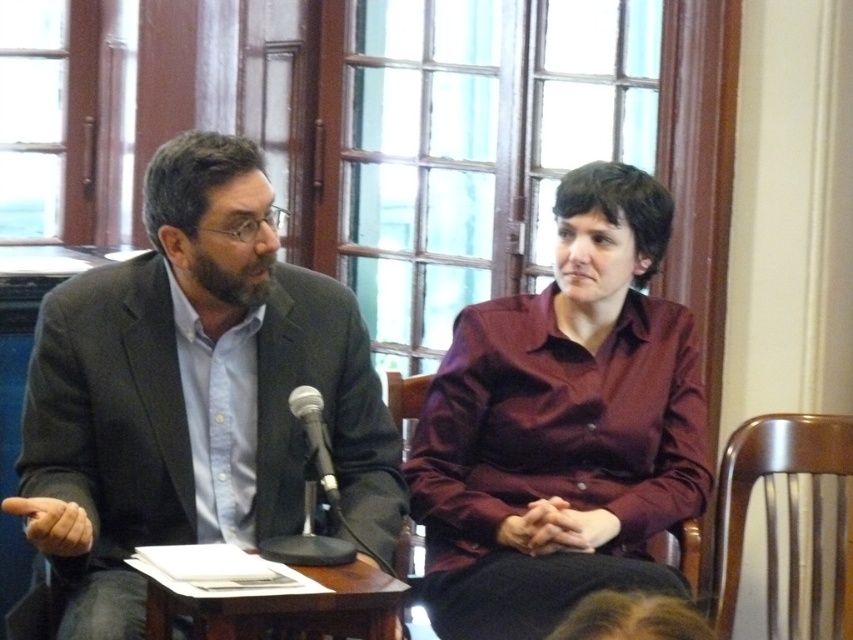
Who is shorter, brown wooden table at center or wooden chair at center?

With less height is brown wooden table at center.

Does point (289, 627) come farther from viewer compared to point (390, 408)?

No, it is in front of (390, 408).

Locate an element on the screen. The width and height of the screenshot is (853, 640). brown wooden table at center is located at coordinates (288, 605).

Can you confirm if matte black suit at left is positioned above brown wooden table at center?

Yes.

The height and width of the screenshot is (640, 853). I want to click on matte black suit at left, so click(192, 392).

Which is more to the right, brown wooden table at center or black metallic microphone at center?

black metallic microphone at center

Based on the photo, does brown wooden table at center come behind black metallic microphone at center?

No, it is in front of black metallic microphone at center.

This screenshot has width=853, height=640. I want to click on brown wooden table at center, so click(x=288, y=605).